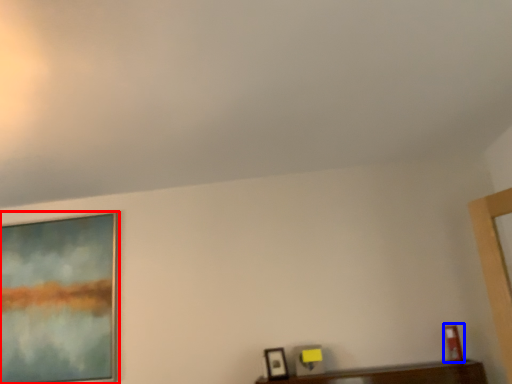
Question: Which of the following is the farthest to the observer, picture frame (highlighted by a red box) or picture frame (highlighted by a blue box)?

Choices:
 (A) picture frame
 (B) picture frame

Answer: (A)